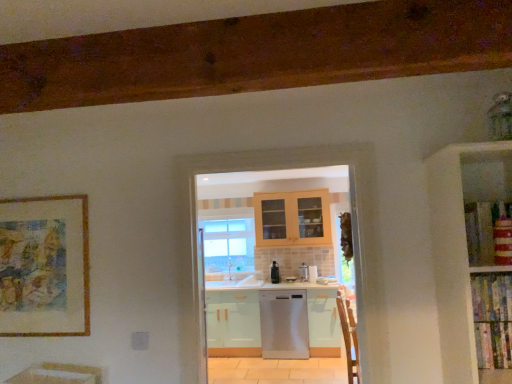
Find the location of `satin black dishwasher at center`. satin black dishwasher at center is located at coordinates (275, 273).

The image size is (512, 384). Describe the element at coordinates (228, 248) in the screenshot. I see `clear glass window at center` at that location.

Locate an element on the screen. wooden armchair at right is located at coordinates (349, 337).

The height and width of the screenshot is (384, 512). I want to click on satin black dishwasher at center, so click(275, 273).

Which object is positioned more to the right, gold-framed artwork at left or satin silver dishwasher at center?

satin silver dishwasher at center.

Can you tell me how much gold-framed artwork at left and satin silver dishwasher at center differ in facing direction?

The angle between the facing direction of gold-framed artwork at left and the facing direction of satin silver dishwasher at center is 0.178 degrees.

Is gold-framed artwork at left completely or partially outside of satin silver dishwasher at center?

gold-framed artwork at left is positioned outside satin silver dishwasher at center.

Considering the relative sizes of gold-framed artwork at left and satin silver dishwasher at center in the image provided, is gold-framed artwork at left smaller than satin silver dishwasher at center?

Yes.

Where is `armchair on the right of satin silver dishwasher at center`? This screenshot has width=512, height=384. armchair on the right of satin silver dishwasher at center is located at coordinates (349, 337).

Which object is further away from the camera taking this photo, wooden armchair at right or satin silver dishwasher at center?

satin silver dishwasher at center is further away from the camera.

Could satin silver dishwasher at center be considered to be inside wooden armchair at right?

No, satin silver dishwasher at center is not surrounded by wooden armchair at right.

Identify the location of appliance on the right of gold-framed artwork at left. (312, 274).

Is satin silver dishwasher at center beside gold-framed artwork at left?

No, satin silver dishwasher at center is not in contact with gold-framed artwork at left.

Is satin silver dishwasher at center further to camera compared to gold-framed artwork at left?

Yes, it is behind gold-framed artwork at left.

Based on the photo, is satin silver dishwasher at center taller or shorter than gold-framed artwork at left?

satin silver dishwasher at center is shorter than gold-framed artwork at left.

Between point (305, 337) and point (18, 300), which one is positioned behind?

The point (305, 337) is more distant.

Based on the photo, is satin silver dishwasher at center not close to gold-framed artwork at left?

Yes, satin silver dishwasher at center is far from gold-framed artwork at left.

Is satin silver dishwasher at center located outside gold-framed artwork at left?

Absolutely, satin silver dishwasher at center is external to gold-framed artwork at left.

Considering the relative positions of clear glass window at center and satin silver dishwasher at center in the image provided, is clear glass window at center in front of satin silver dishwasher at center?

No, clear glass window at center is further to the viewer.

Is clear glass window at center looking in the opposite direction of satin silver dishwasher at center?

That's not correct — clear glass window at center is not looking away from satin silver dishwasher at center.

Could satin silver dishwasher at center be considered to be inside clear glass window at center?

Definitely not — satin silver dishwasher at center is not inside clear glass window at center.

Who is smaller, clear glass window at center or satin silver dishwasher at center?

With smaller size is clear glass window at center.

Between wooden armchair at right and clear glass window at center, which one has larger size?

clear glass window at center.

Considering the relative positions of wooden armchair at right and clear glass window at center in the image provided, is wooden armchair at right to the left of clear glass window at center from the viewer's perspective?

No, wooden armchair at right is not to the left of clear glass window at center.

How far apart are wooden armchair at right and clear glass window at center?

3.84 meters.

Where is `armchair that appears below the clear glass window at center (from the image's perspective)`? The image size is (512, 384). armchair that appears below the clear glass window at center (from the image's perspective) is located at coordinates (349, 337).

From a real-world perspective, is satin black dishwasher at center on clear glass window at center?

Incorrect, from a real-world perspective, satin black dishwasher at center is lower than clear glass window at center.

From the image's perspective, which one is positioned lower, satin black dishwasher at center or clear glass window at center?

satin black dishwasher at center appears lower in the image.

Looking at this image, is the position of satin black dishwasher at center more distant than that of clear glass window at center?

That is False.

Where is `window above the satin black dishwasher at center (from a real-world perspective)`? The image size is (512, 384). window above the satin black dishwasher at center (from a real-world perspective) is located at coordinates (228, 248).

Find the location of a particular element. home appliance directly beneath the gold-framed artwork at left (from a real-world perspective) is located at coordinates (284, 324).

Identify the location of armchair lying in front of the satin silver dishwasher at center. (349, 337).

When comparing their distances from clear glass window at center, does gold-framed artwork at left or satin black dishwasher at center seem closer?

satin black dishwasher at center is positioned closer to the anchor clear glass window at center.

Based on their spatial positions, is gold-framed artwork at left or satin silver dishwasher at center further from satin black dishwasher at center?

gold-framed artwork at left.

Looking at the image, which one is located closer to wooden armchair at right, satin black dishwasher at center or satin silver dishwasher at center?

The object closer to wooden armchair at right is satin silver dishwasher at center.

Considering their positions, is satin silver dishwasher at center positioned further to satin silver dishwasher at center than satin black dishwasher at center?

satin silver dishwasher at center is positioned further to the anchor satin silver dishwasher at center.

Considering their positions, is satin black dishwasher at center positioned further to wooden armchair at right than satin silver dishwasher at center?

Among the two, satin black dishwasher at center is located further to wooden armchair at right.

Based on their spatial positions, is satin black dishwasher at center or satin silver dishwasher at center further from clear glass window at center?

Among the two, satin silver dishwasher at center is located further to clear glass window at center.

Which object lies nearer to the anchor point clear glass window at center, gold-framed artwork at left or satin silver dishwasher at center?

satin silver dishwasher at center is closer to clear glass window at center.

Looking at the image, which one is located further to satin silver dishwasher at center, clear glass window at center or wooden armchair at right?

Among the two, wooden armchair at right is located further to satin silver dishwasher at center.

Locate an element on the screen. kitchen appliance between clear glass window at center and satin silver dishwasher at center vertically is located at coordinates (275, 273).

Identify the location of home appliance between wooden armchair at right and clear glass window at center from front to back. tap(284, 324).

Find the location of a particular element. kitchen appliance between clear glass window at center and satin silver dishwasher at center from left to right is located at coordinates (275, 273).

This screenshot has height=384, width=512. In order to click on kitchen appliance between wooden armchair at right and clear glass window at center along the z-axis in this screenshot , I will do `click(275, 273)`.